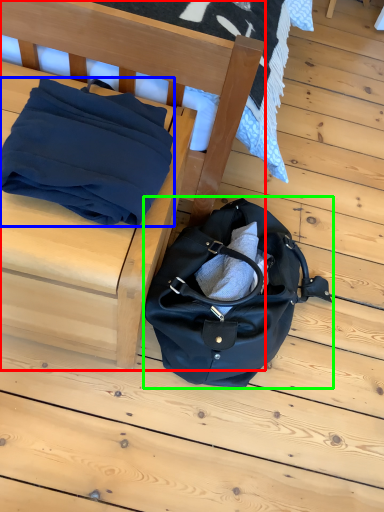
Question: Which is farther away from furniture (highlighted by a red box)? blanket (highlighted by a blue box) or handbag (highlighted by a green box)?

Choices:
 (A) blanket
 (B) handbag

Answer: (B)